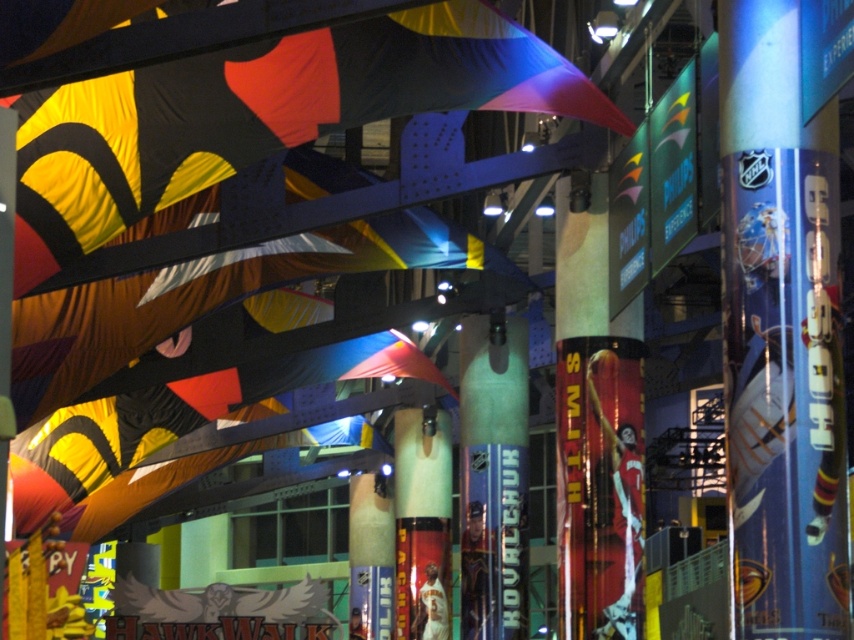
Can you confirm if matte fabric flag at upper center is bigger than green glossy pillar at center?

Yes.

Does point (297, 113) lie behind point (488, 536)?

That is False.

Which is in front, point (244, 67) or point (515, 432)?

Point (244, 67) is more forward.

Locate an element on the screen. Image resolution: width=854 pixels, height=640 pixels. matte fabric flag at upper center is located at coordinates (262, 115).

Who is shorter, metallic blue hockey stick at center or matte fabric flag at upper center?

With less height is matte fabric flag at upper center.

What do you see at coordinates (781, 333) in the screenshot? I see `metallic blue hockey stick at center` at bounding box center [781, 333].

Locate an element on the screen. metallic blue hockey stick at center is located at coordinates (781, 333).

Based on the photo, is metallic blue hockey stick at center above green glossy pillar at center?

Yes, metallic blue hockey stick at center is above green glossy pillar at center.

Measure the distance between point [738,36] and camera.

34.52 meters

Locate an element on the screen. The height and width of the screenshot is (640, 854). metallic blue hockey stick at center is located at coordinates (781, 333).